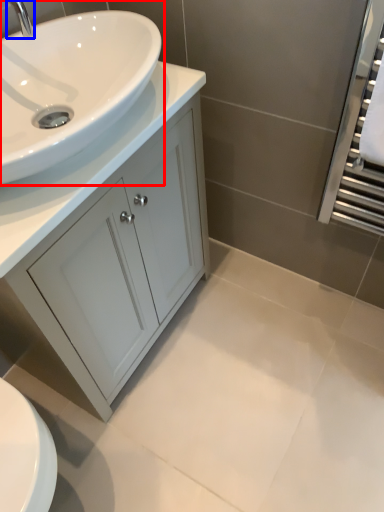
Question: Which point is further to the camera, sink (highlighted by a red box) or tap (highlighted by a blue box)?

Choices:
 (A) sink
 (B) tap

Answer: (B)